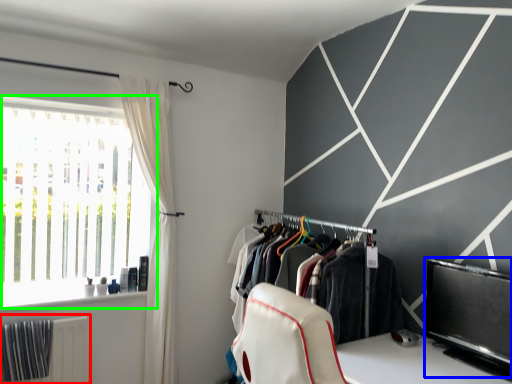
Question: Considering the real-world distances, which object is farthest from radiator (highlighted by a red box)? window screen (highlighted by a blue box) or window (highlighted by a green box)?

Choices:
 (A) window screen
 (B) window

Answer: (A)